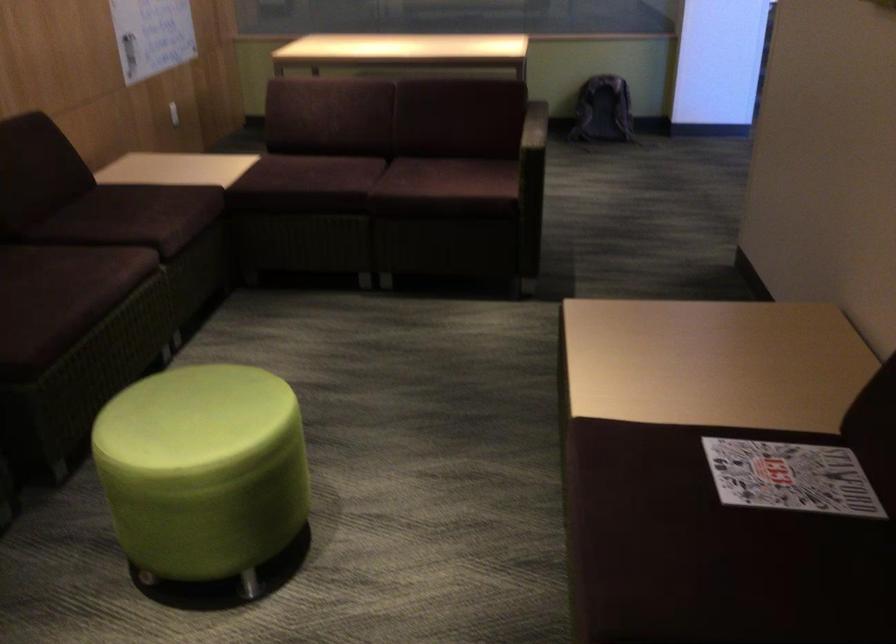
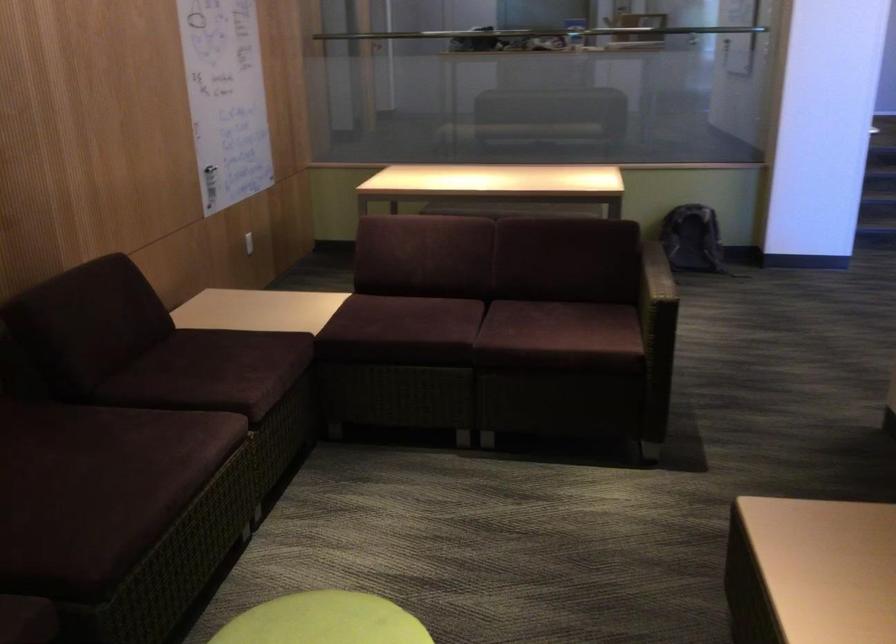
Question: The images are taken continuously from a first-person perspective. In which direction is your viewpoint rotating?

Choices:
 (A) Left
 (B) Right
 (C) Up
 (D) Down

Answer: (C)